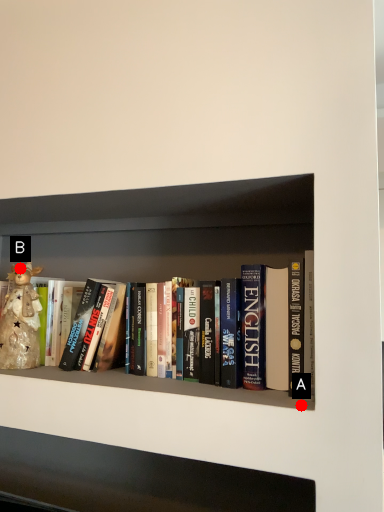
Question: Two points are circled on the image, labeled by A and B beside each circle. Which point is closer to the camera?

Choices:
 (A) A is closer
 (B) B is closer

Answer: (A)